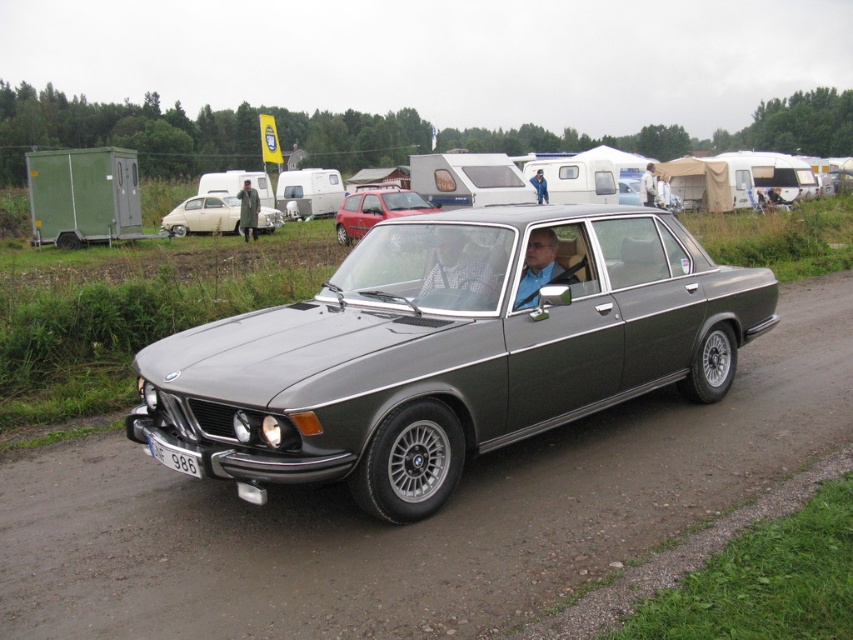
You are a photographer trying to capture the beige matte sedan at center and the white plastic license plate at lower center in the same frame. Which object should you focus on first if you want to ensure both are in focus without adjusting your camera settings?

The beige matte sedan at center is thinner than the white plastic license plate at lower center, so focusing on the beige matte sedan at center first would help ensure both are in focus since it is closer to the camera.

You are a photographer standing at the edge of the gray asphalt road at center and want to take a photo of the matte gray car at center. Which object is closer to you, the photographer, so that you can focus on it properly?

The matte gray car at center is closer to you than the gray asphalt road at center, so you should focus on the matte gray car at center to ensure proper focus.